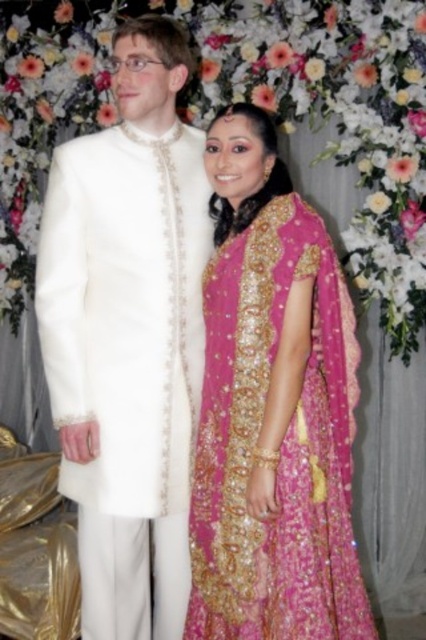
You are a photographer adjusting the camera settings to capture the couple in the scene. You notice two points marked in the frame at coordinates point (55, 394) and point (219, 406). Which point is closer to the camera lens?

Point (219, 406) is closer to the camera lens because the Objects Description states that point (55, 394) is behind point (219, 406).

You are a photographer at a wedding venue. You need to capture a photo where the white satin sherwani at left and the fuchsia satin lehenga at center are both visible. Based on their positions, which outfit is higher in the frame?

The white satin sherwani at left is above the fuchsia satin lehenga at center, so it is higher in the frame.

Based on the scene description, where is the white satin sherwani at left located in the image?

The white satin sherwani at left is located at point (x=129, y=336) in the image.